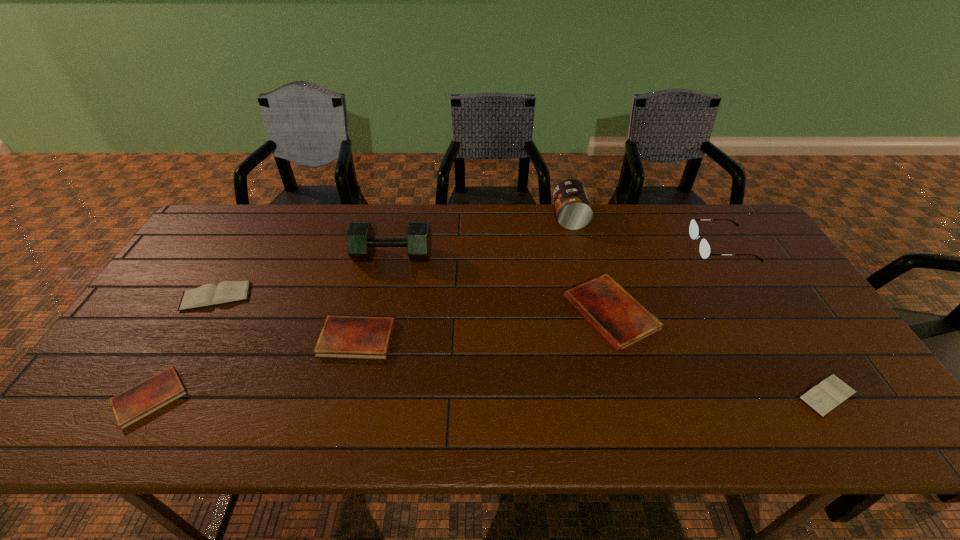
At what (x,y) coordinates should I click in order to perform the action: click on can. Please return your answer as a coordinate pair (x, y). The width and height of the screenshot is (960, 540). Looking at the image, I should click on (573, 209).

This screenshot has height=540, width=960. I want to click on dumbbell, so click(361, 242).

Image resolution: width=960 pixels, height=540 pixels. Identify the location of black spectacles. (705, 250).

Locate an element on the screen. spectacles is located at coordinates (705, 250).

Locate an element on the screen. This screenshot has width=960, height=540. the rightmost red diary is located at coordinates (613, 312).

This screenshot has height=540, width=960. Identify the location of the biggest red diary. (613, 312).

This screenshot has height=540, width=960. In order to click on the bigger brown diary in this screenshot , I will do `click(206, 295)`.

Where is `the left brown diary`? This screenshot has height=540, width=960. the left brown diary is located at coordinates (206, 295).

Where is `the second red diary from right to left`? the second red diary from right to left is located at coordinates (360, 337).

Where is `the third diary from left to right`? the third diary from left to right is located at coordinates (360, 337).